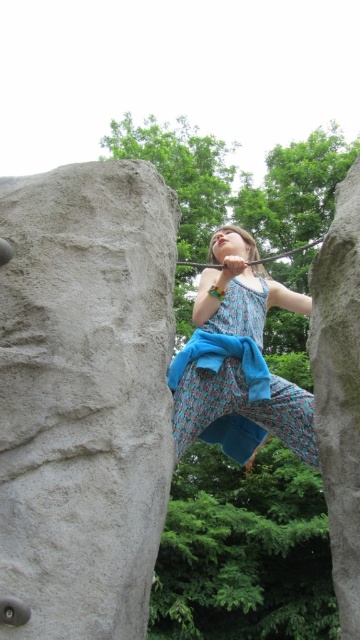
Can you confirm if gray rough rock at left is shorter than floral dress at center?

In fact, gray rough rock at left may be taller than floral dress at center.

Is point (57, 259) more distant than point (236, 394)?

No.

The width and height of the screenshot is (360, 640). I want to click on gray rough rock at left, so click(x=84, y=394).

Which is above, gray rough rock at left or smooth gray rock at right?

Positioned higher is gray rough rock at left.

From the picture: Who is more distant from viewer, (83, 490) or (338, 570)?

The point (338, 570) is behind.

I want to click on gray rough rock at left, so pos(84,394).

Does floral dress at center appear under smooth gray rock at right?

No.

Where is `floral dress at center`? floral dress at center is located at coordinates pyautogui.click(x=237, y=356).